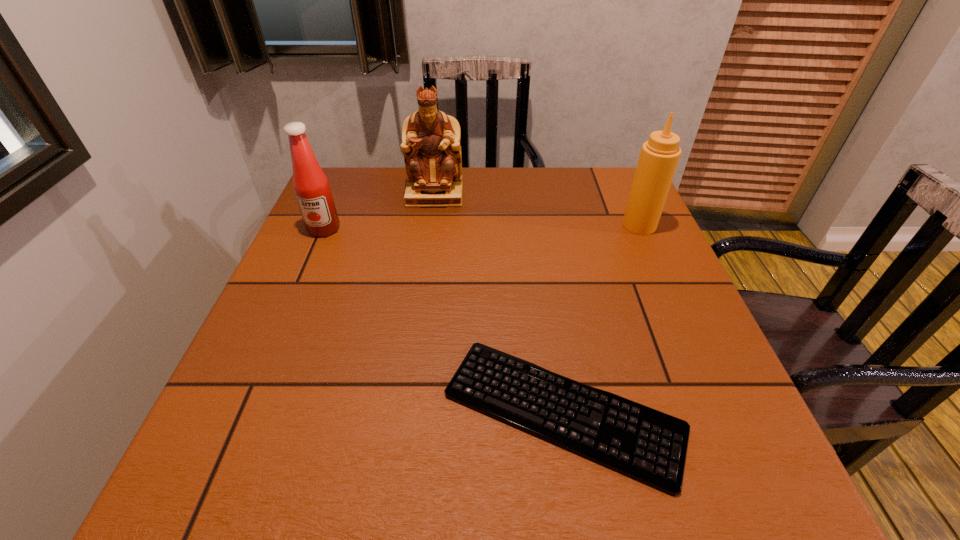
Locate an element on the screen. the right condiment is located at coordinates (659, 156).

Where is `the farthest object`? the farthest object is located at coordinates (431, 146).

Find the location of a particular element. the leftmost object is located at coordinates (312, 190).

Identify the location of the nearest object. (645, 444).

This screenshot has width=960, height=540. Find the location of `the shortest object`. the shortest object is located at coordinates (645, 444).

Find the location of a particular element. free region located on the front of the rightmost object is located at coordinates coord(694,349).

Locate an element on the screen. vacant area situated on the front-facing side of the figurine is located at coordinates (428, 246).

You are a GUI agent. You are given a task and a screenshot of the screen. Output one action in this format:
    pyautogui.click(x=<x>, y=<y>)
    Task: Click on the vacant area located 0.250m on the front-facing side of the left condiment
    This screenshot has width=960, height=540.
    Given the screenshot: What is the action you would take?
    287,315

You are a GUI agent. You are given a task and a screenshot of the screen. Output one action in this format:
    pyautogui.click(x=<x>, y=<y>)
    Task: Click on the vacant area situated 0.290m on the left of the shortest object
    The image size is (960, 540).
    Given the screenshot: What is the action you would take?
    pyautogui.click(x=269, y=411)

You are a GUI agent. You are given a task and a screenshot of the screen. Output one action in this format:
    pyautogui.click(x=<x>, y=<y>)
    Task: Click on the object located at the far edge
    This screenshot has height=540, width=960.
    Given the screenshot: What is the action you would take?
    pyautogui.click(x=431, y=146)